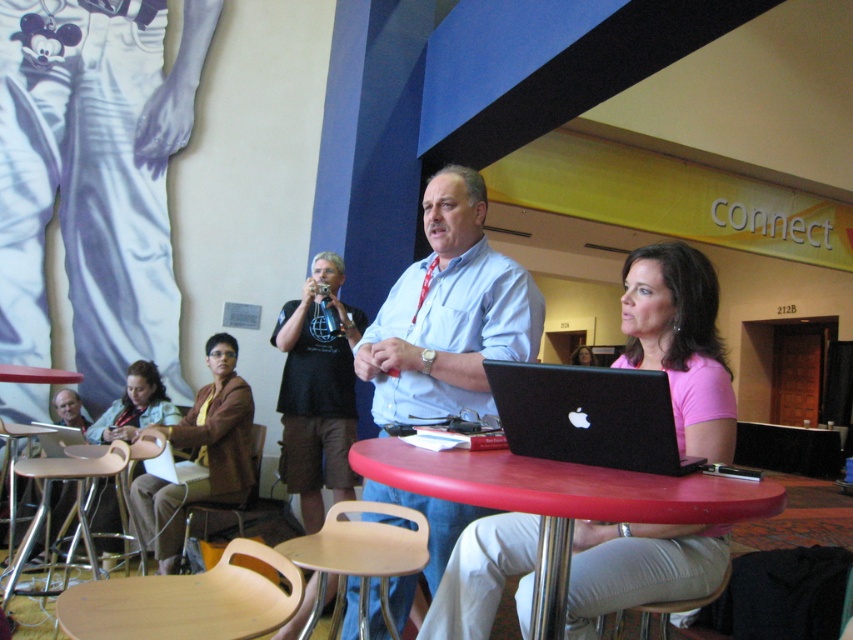
In the conference room scene, where is the light blue shirt at center located in terms of its 2D coordinates?

The light blue shirt at center is located at the 2D coordinates point (450, 314).

You are standing in the conference room and want to reach the point marked at coordinates (695, 292). If your arm can extend 1.8 meters, can you reach it without moving your feet?

The point at coordinates (695, 292) is 1.96 meters away from the viewer. Since your arm can only extend 1.8 meters, you cannot reach it without moving your feet.